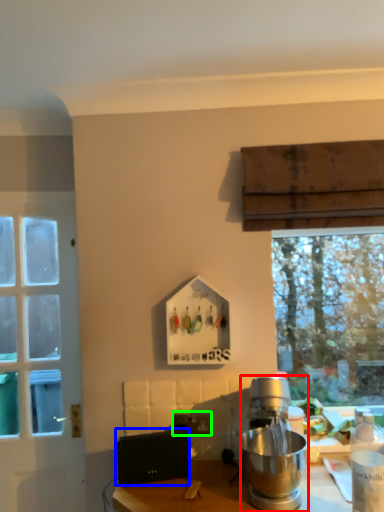
Question: Which is nearer to the kitchen appliance (highlighted by a red box)? appliance (highlighted by a blue box) or power outlet (highlighted by a green box).

Choices:
 (A) appliance
 (B) power outlet

Answer: (B)